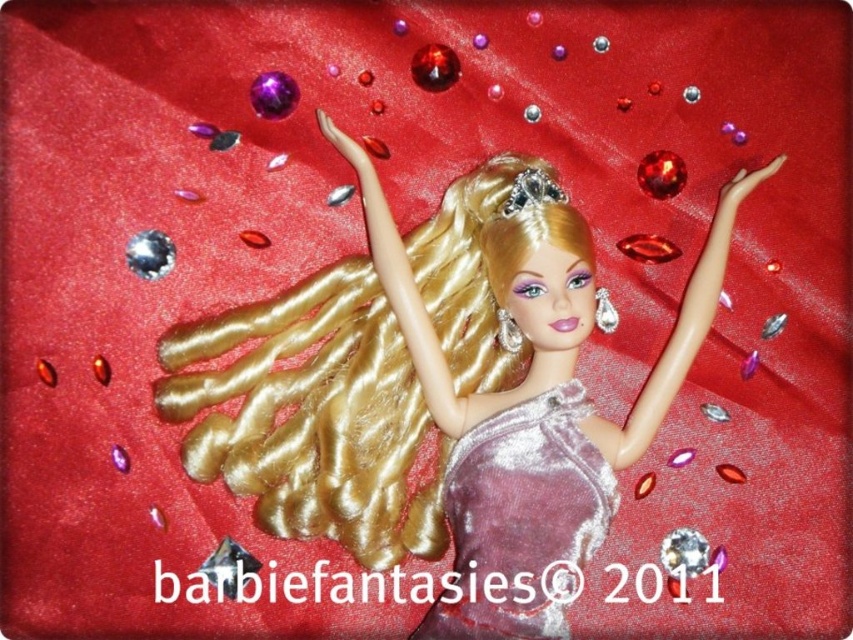
Does point (451, 260) come closer to viewer compared to point (454, 566)?

No, (451, 260) is further to viewer.

Which is below, shiny gold hair at center or satin purple dress at center?

satin purple dress at center

Between point (222, 422) and point (521, 490), which one is positioned behind?

The point (222, 422) is more distant.

Identify the location of shiny gold hair at center. (312, 417).